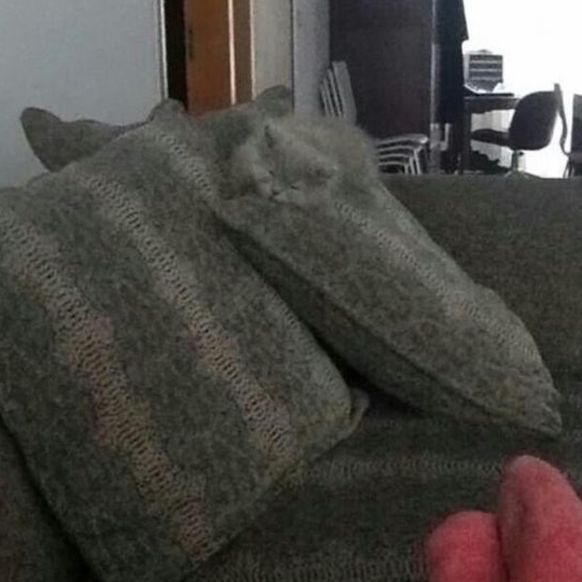
Where is `gray pillows`? This screenshot has width=582, height=582. gray pillows is located at coordinates (265, 418), (343, 275).